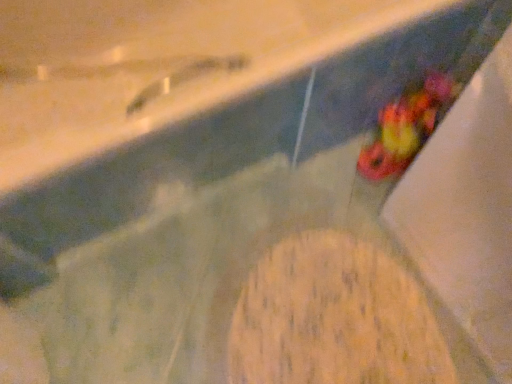
Question: Looking at the image, does wooden cutting board at center, the first food when ordered from bottom to top, seem bigger or smaller compared to multicolored plastic toy at lower right, arranged as the second food when ordered from the bottom?

Choices:
 (A) small
 (B) big

Answer: (B)

Question: Is point (258, 266) positioned closer to the camera than point (410, 117)?

Choices:
 (A) closer
 (B) farther

Answer: (A)

Question: From the image's perspective, is wooden cutting board at center, the first food when ordered from bottom to top, above or below multicolored plastic toy at lower right, arranged as the second food when ordered from the bottom?

Choices:
 (A) above
 (B) below

Answer: (B)

Question: From the image's perspective, is multicolored plastic toy at lower right, arranged as the second food when ordered from the bottom, located above or below wooden cutting board at center, the first food when ordered from bottom to top?

Choices:
 (A) below
 (B) above

Answer: (B)

Question: From a real-world perspective, is multicolored plastic toy at lower right, marked as the first food in a top-to-bottom arrangement, above or below wooden cutting board at center, which is the second food in top-to-bottom order?

Choices:
 (A) below
 (B) above

Answer: (B)

Question: Choose the correct answer: Is multicolored plastic toy at lower right, marked as the first food in a top-to-bottom arrangement, inside wooden cutting board at center, which is the second food in top-to-bottom order, or outside it?

Choices:
 (A) outside
 (B) inside

Answer: (A)

Question: Visually, is multicolored plastic toy at lower right, marked as the first food in a top-to-bottom arrangement, positioned to the left or to the right of wooden cutting board at center, which is the second food in top-to-bottom order?

Choices:
 (A) right
 (B) left

Answer: (A)